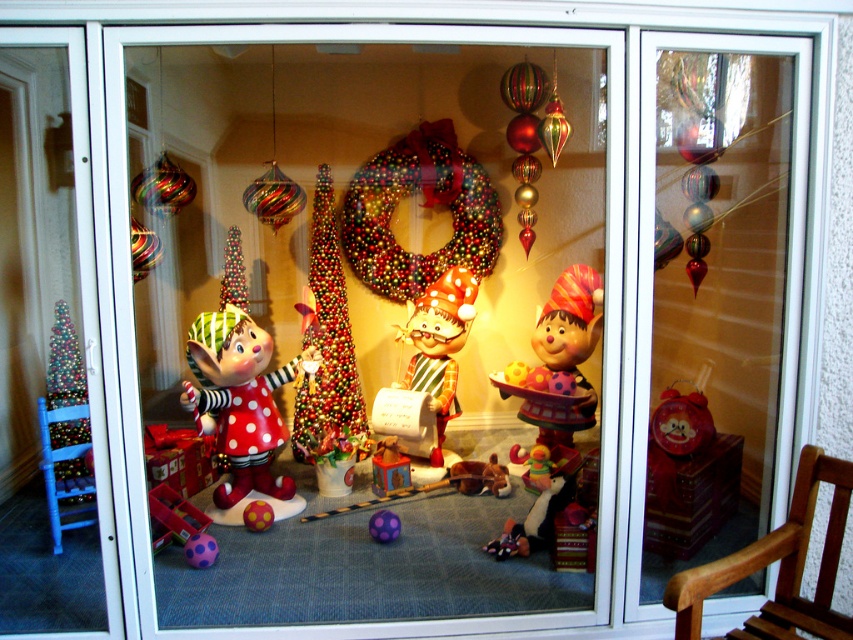
You are standing in front of the festive holiday display and want to touch the two points mentioned. Which point, point (795, 173) or point (318, 396), will you reach first?

Point (795, 173) is closer to the viewer than point (318, 396), so you will reach point (795, 173) first.

You are a visitor looking at the festive holiday display. You notice the glossy fabric wreath at center and the wooden rocking chair at lower right. Which object is positioned to the left when viewed from your perspective?

The glossy fabric wreath at center is to the left of the wooden rocking chair at lower right, so the wreath is positioned to the left.

You are a customer standing in front of the festive holiday display. You notice both the glossy fabric wreath at center and the shiny metallic christmas tree at center. Which one is positioned higher in the display?

The glossy fabric wreath at center is located above the shiny metallic christmas tree at center, so it is positioned higher in the display.